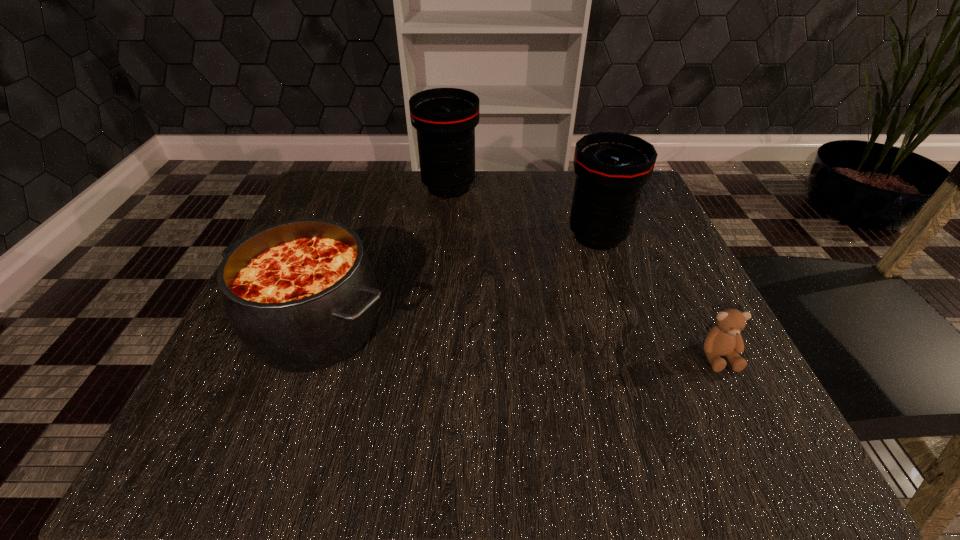
At what (x,y) coordinates should I click in order to perform the action: click on vacant region located on the face of the teddy bear. Please return your answer as a coordinate pair (x, y). The width and height of the screenshot is (960, 540). Looking at the image, I should click on (746, 410).

I want to click on object at the left edge, so click(x=301, y=295).

Where is `telephoto lens that is at the right edge`? telephoto lens that is at the right edge is located at coordinates (611, 168).

You are a GUI agent. You are given a task and a screenshot of the screen. Output one action in this format:
    pyautogui.click(x=<x>, y=<y>)
    Task: Click on the teddy bear located in the right edge section of the desktop
    The width and height of the screenshot is (960, 540).
    Given the screenshot: What is the action you would take?
    pyautogui.click(x=725, y=339)

I want to click on object that is at the far right corner, so click(x=611, y=168).

This screenshot has width=960, height=540. In order to click on free space at the far edge of the desktop in this screenshot , I will do `click(561, 219)`.

Locate an element on the screen. The width and height of the screenshot is (960, 540). vacant space at the near edge of the desktop is located at coordinates (397, 437).

The image size is (960, 540). Identify the location of vacant space at the right edge of the desktop. (674, 267).

This screenshot has height=540, width=960. In order to click on blank space at the far left corner of the desktop in this screenshot , I will do `click(368, 203)`.

The image size is (960, 540). Find the location of `free spot at the near left corner of the desktop`. free spot at the near left corner of the desktop is located at coordinates pyautogui.click(x=202, y=467).